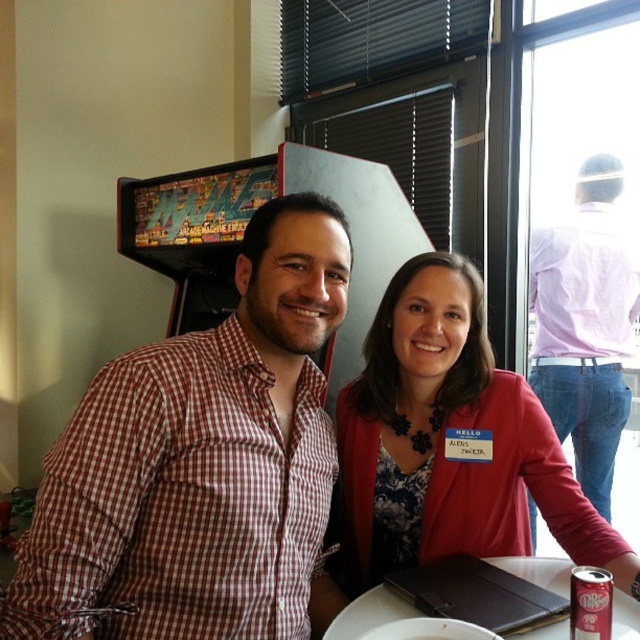
Is checkered fabric shirt at center smaller than matte pink blazer at center?

Yes.

Who is more distant from viewer, (x=260, y=627) or (x=513, y=518)?

The point (x=513, y=518) is behind.

The width and height of the screenshot is (640, 640). Find the location of `checkered fabric shirt at center`. checkered fabric shirt at center is located at coordinates (198, 461).

How distant is matte pink blazer at center from white glossy plate at center?

matte pink blazer at center is 10.07 inches away from white glossy plate at center.

Measure the distance between matte pink blazer at center and camera.

matte pink blazer at center is 3.69 feet away from camera.

You are a GUI agent. You are given a task and a screenshot of the screen. Output one action in this format:
    pyautogui.click(x=<x>, y=<y>)
    Task: Click on the matte pink blazer at center
    Image resolution: width=640 pixels, height=640 pixels.
    Given the screenshot: What is the action you would take?
    pyautogui.click(x=445, y=448)

How distant is checkered fabric shirt at center from white glossy plate at center?

A distance of 15.20 inches exists between checkered fabric shirt at center and white glossy plate at center.

Can you confirm if checkered fabric shirt at center is bigger than white glossy plate at center?

Yes, checkered fabric shirt at center is bigger than white glossy plate at center.

Which is behind, point (310, 310) or point (563, 580)?

Positioned behind is point (563, 580).

The width and height of the screenshot is (640, 640). Find the location of `checkered fabric shirt at center`. checkered fabric shirt at center is located at coordinates (198, 461).